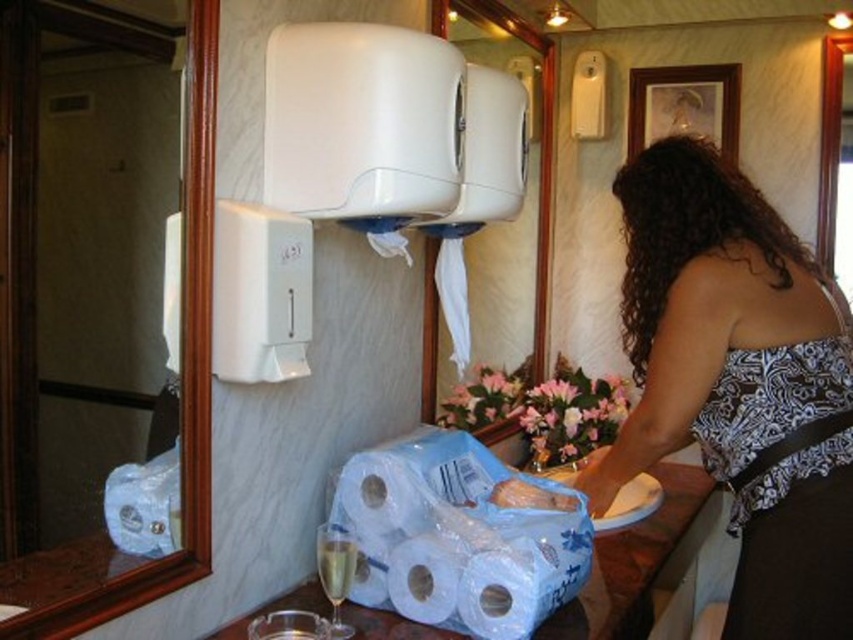
You are organizing a dinner party and need to place the black satin apron at right and the clear glass wine glass at lower left on a shelf. The shelf can only hold items up to 12 inches in height. Which item might not fit if the apron is 14 inches tall and the wine glass is 9 inches tall?

The black satin apron at right is 14 inches tall, which exceeds the shelf height limit of 12 inches, so it might not fit.

You are a guest in this bathroom and need to dry your hands. You see the white glossy toilet paper at lower center and the white matte paper towel at lower center. Which one is located higher?

Result: The white glossy toilet paper at lower center is located higher than the white matte paper towel at lower center.